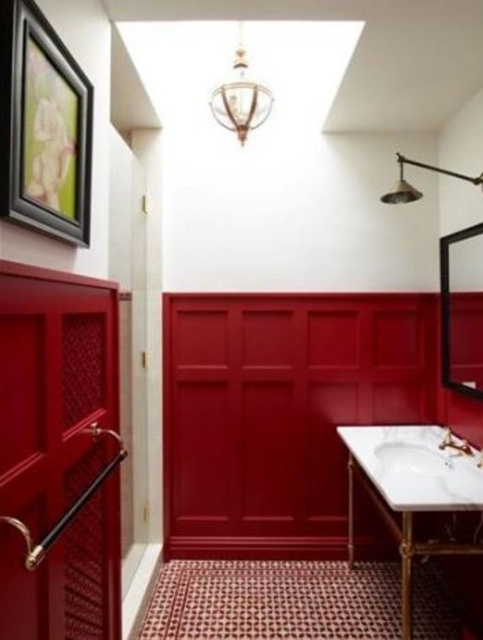
Question: Which point is farther from the camera taking this photo?

Choices:
 (A) (399, 172)
 (B) (430, 480)
 (C) (470, 445)

Answer: (A)

Question: Among these points, which one is nearest to the camera?

Choices:
 (A) (349, 440)
 (B) (453, 436)

Answer: (B)

Question: Is white marble sink at lower right in front of metallic brass shower head at upper center?

Choices:
 (A) no
 (B) yes

Answer: (B)

Question: Is metallic brass shower head at upper center positioned at the back of matte gold faucet at lower center?

Choices:
 (A) yes
 (B) no

Answer: (B)

Question: Can you confirm if white marble vanity at center is smaller than metallic brass shower head at upper center?

Choices:
 (A) yes
 (B) no

Answer: (B)

Question: Based on their relative distances, which object is farther from the metallic brass shower head at upper center?

Choices:
 (A) white marble sink at lower right
 (B) matte gold faucet at lower center

Answer: (A)